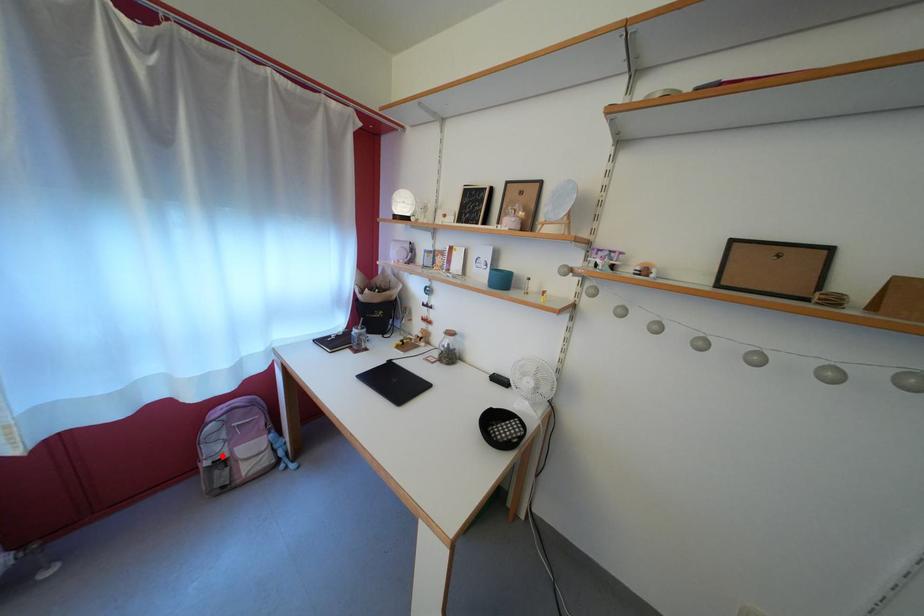
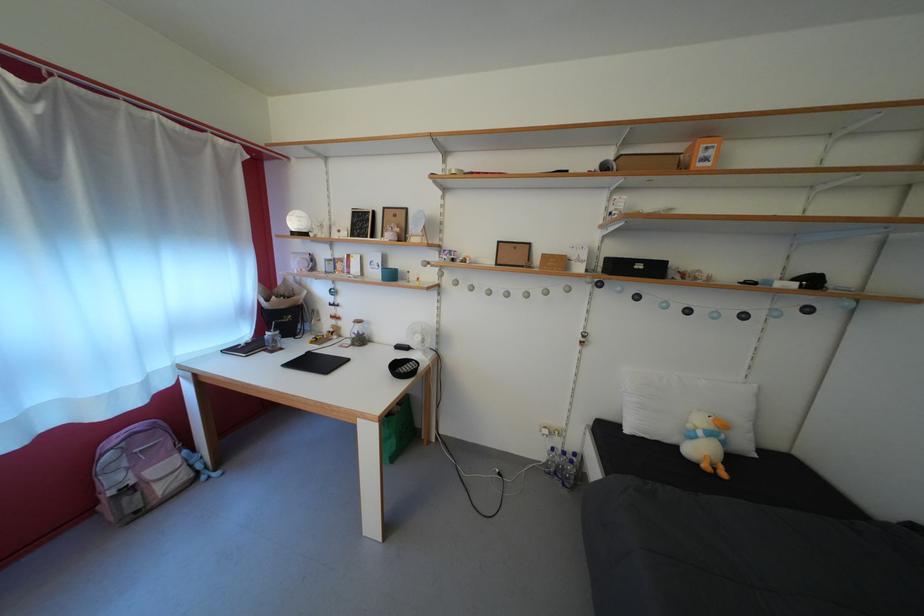
Locate, in the second image, the point that corresponds to the highlighted location in the first image.

(123, 485)